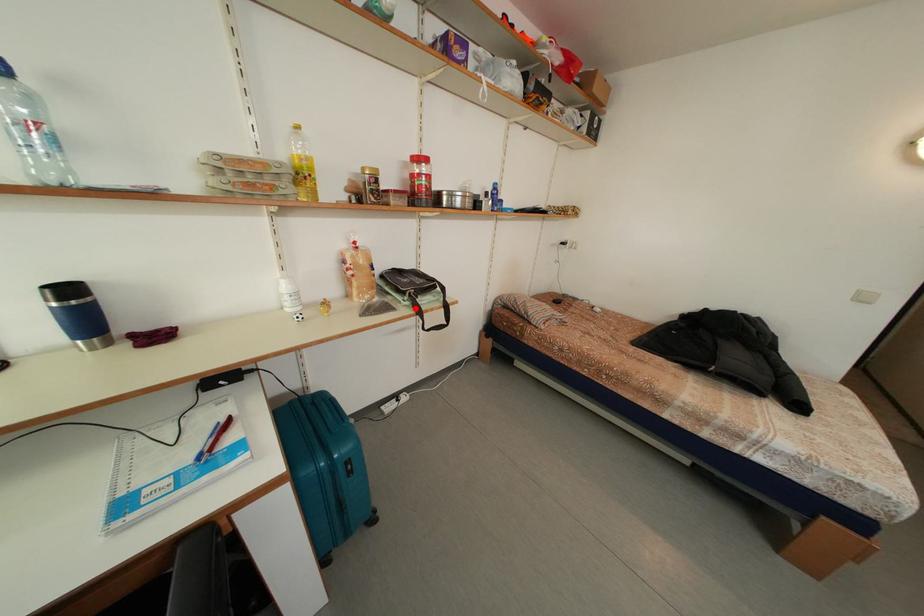
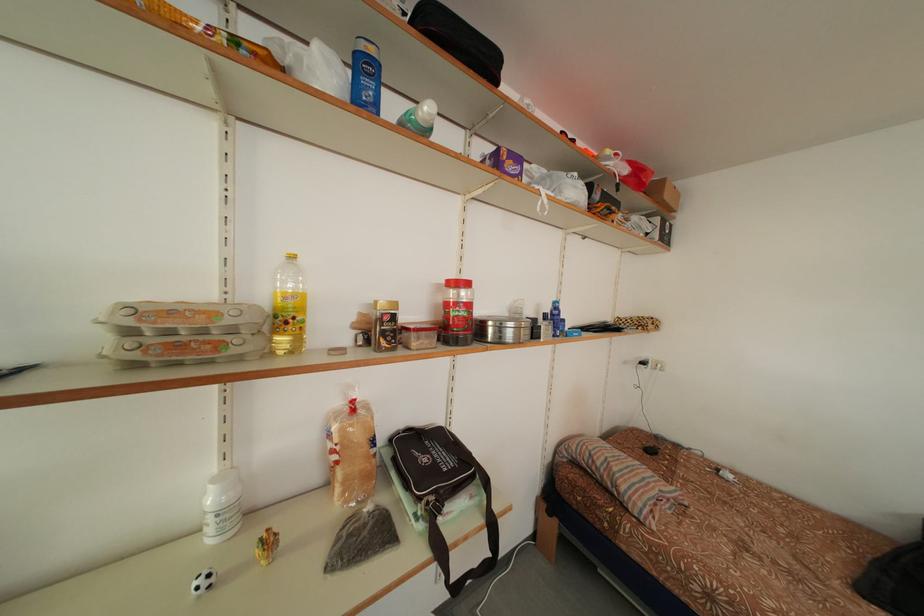
The point at the highlighted location is marked in the first image. Where is the corresponding point in the second image?

(429, 531)